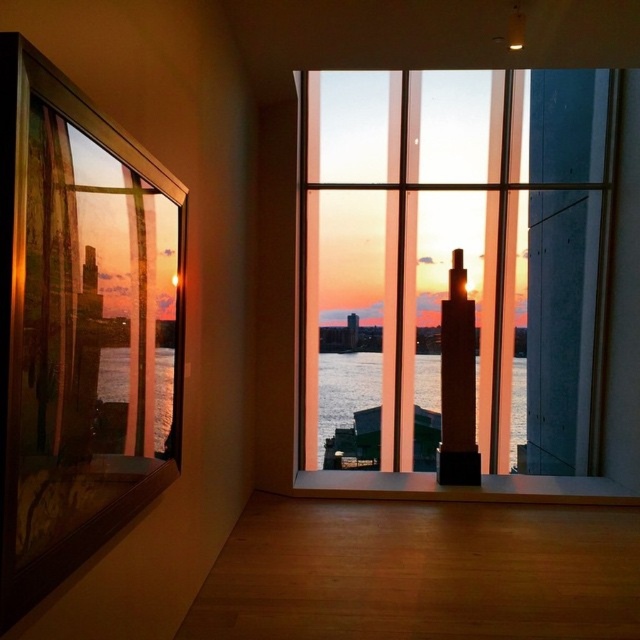
You are an interior designer assessing the room layout. You need to place a large potted plant that requires maximum sunlight. Given the transparent glass window at center and the transparent glass window at left, which window should you choose for the plant?

The transparent glass window at center is larger in size than the transparent glass window at left, so it likely allows more sunlight to enter, making it the better choice for placing the large potted plant that requires maximum sunlight.

You are standing in the room and want to know how far the point at coordinates (477, 131) is from you. Can you determine the distance?

The point at coordinates (477, 131) is 6.41 meters away from you.

You are standing in the room and want to look at the cityscape outside through the transparent glass window at left and the translucent glass water at center. Which object allows you to see the outside view more clearly?

The transparent glass window at left allows you to see the outside view more clearly than the translucent glass water at center because it is less obstructive.